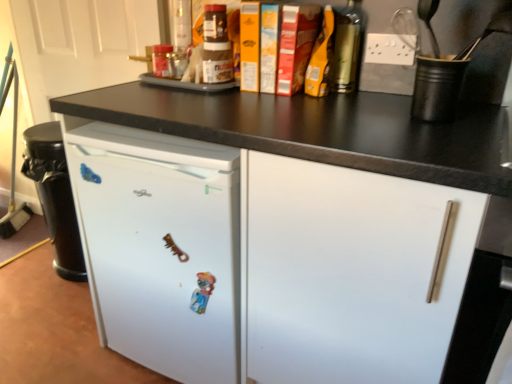
Identify the location of free spot behind black matte cup at upper right. (386, 100).